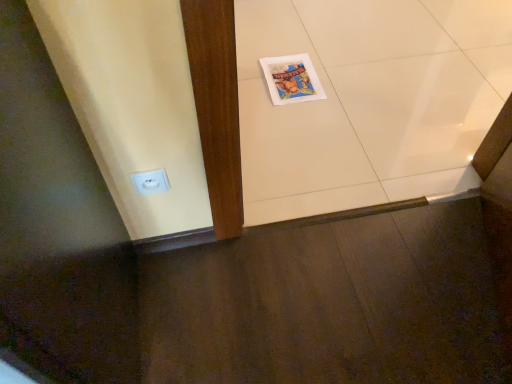
Identify the location of vacant space to the right of matte paper comic book at center. The width and height of the screenshot is (512, 384). (351, 77).